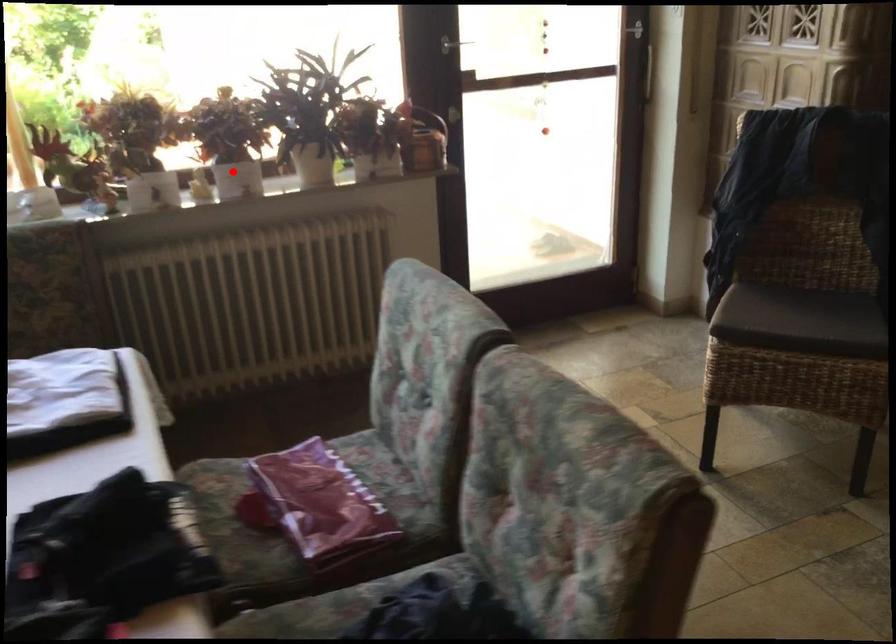
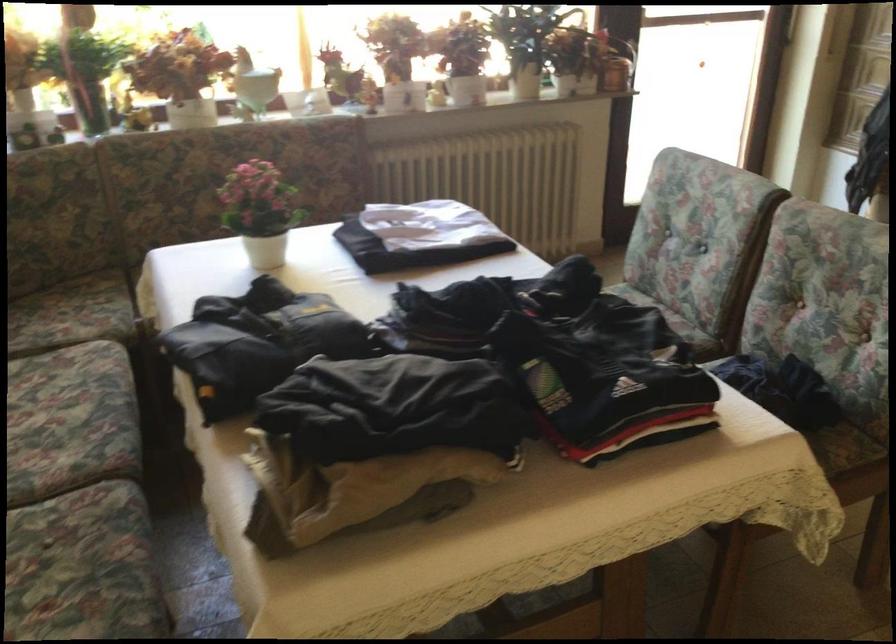
In the second image, find the point that corresponds to the highlighted location in the first image.

(467, 84)